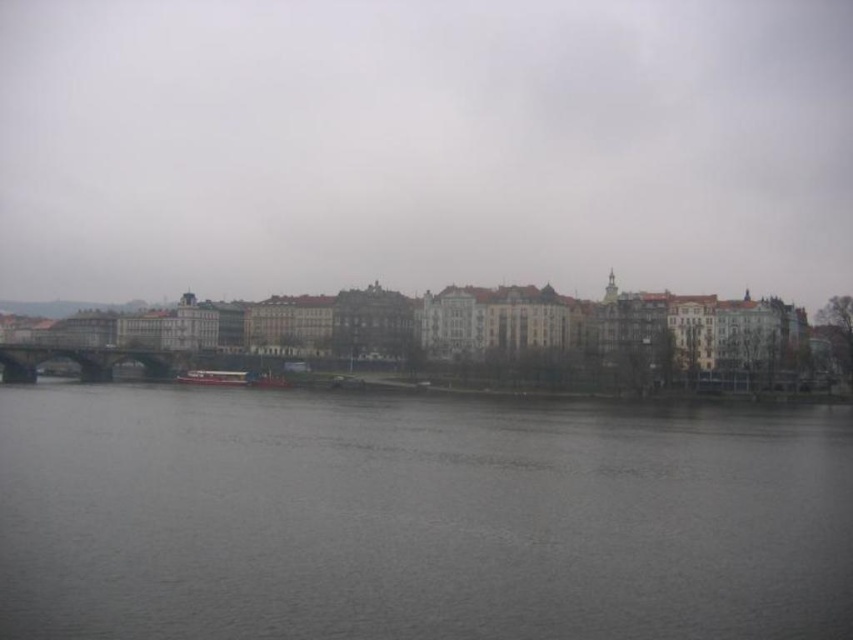
You are standing at the point labeled as point (416, 518) in the image. What is the color of the surface you are currently standing on?

The point (416, 518) is on gray water at center, so the surface is gray water.

You are a tourist standing on the green stone bridge at center, looking at the gray water at center. Which object occupies more area in the scene?

The gray water at center is larger in size than the green stone bridge at center, so the gray water at center occupies more area in the scene.

You are a tourist standing on the bridge in the river scene. You notice the matte gray buildings at center and the gray water at center. Which one appears bigger in the image?

The matte gray buildings at center is larger in size than gray water at center, so the matte gray buildings at center appears bigger in the image.